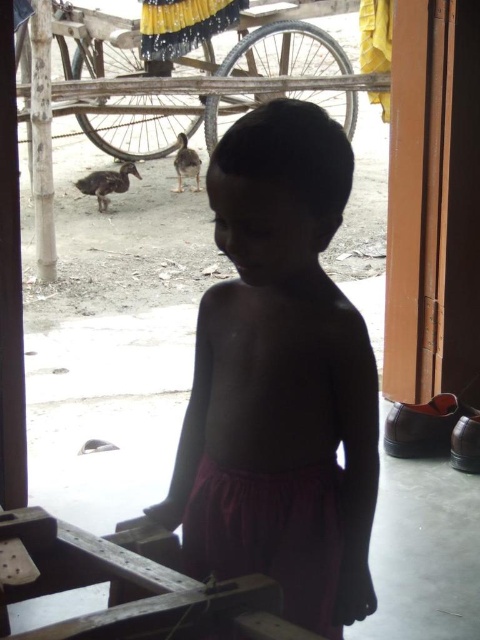
You are a photographer trying to capture a clear photo of the brown matte duck at lower left. However, the matte purple skirt at center is blocking your view. Based on the scene description, can you determine if the duck is still visible through the skirt?

The matte purple skirt at center is in front of the brown matte duck at lower left, so the duck is completely blocked and not visible through the skirt.

You are a parent looking for your child who is outside playing with two ducks. You see the brown matte duck at lower left and the brown fuzzy duckling at center. Which duck is closer to your child?

The brown matte duck at lower left is closer to the child because it is positioned under the brown fuzzy duckling at center, which is further away.